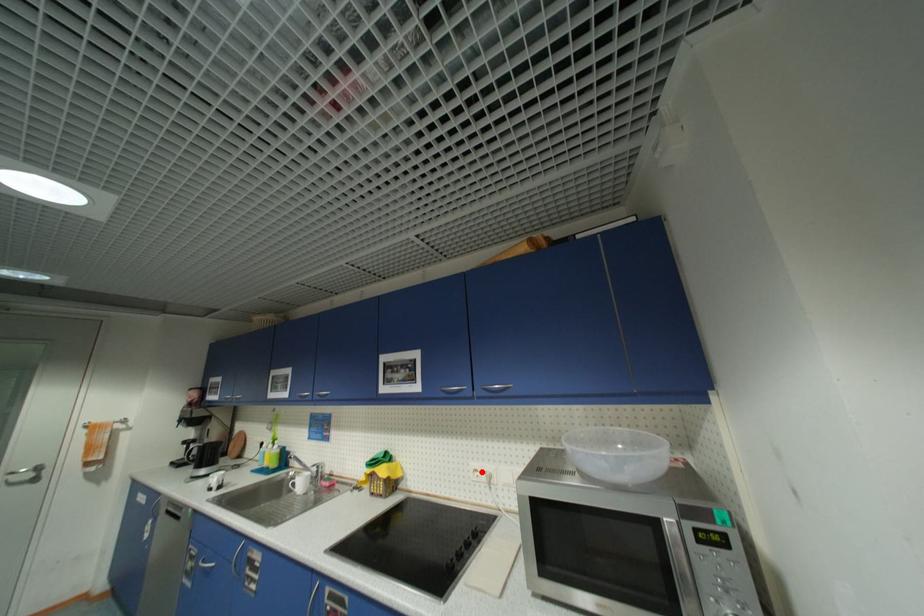
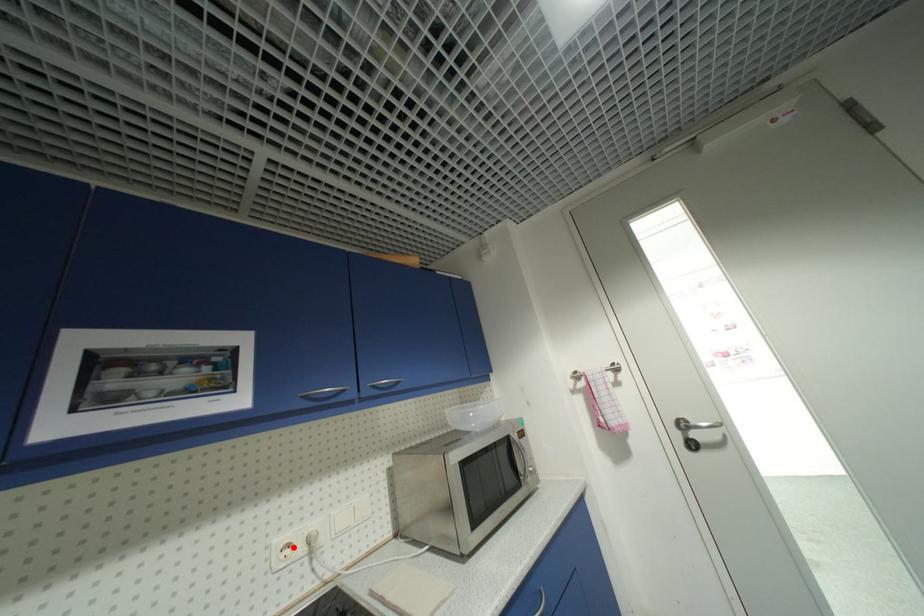
I am providing you with two images of the same scene from different viewpoints. A red point is marked on the first image and another point is marked on the second image. Are the points marked in image1 and image2 representing the same 3D position?

Yes